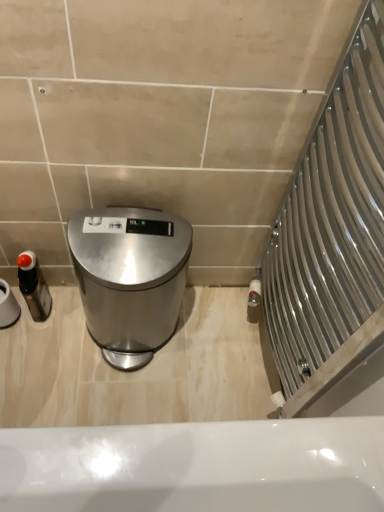
Find the location of a particular element. vacant region above satin silver trash can at center (from a real-world perspective) is located at coordinates (130, 238).